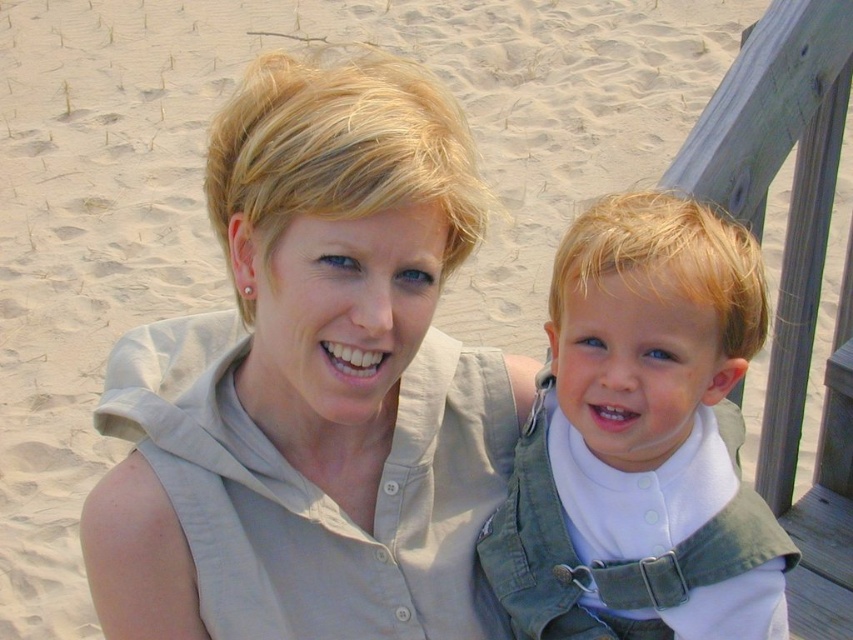
Question: Which point is farther to the camera?

Choices:
 (A) (366, 76)
 (B) (715, 572)

Answer: (B)

Question: Does matte beige shirt at upper center have a greater width compared to light green denim overalls at center?

Choices:
 (A) no
 (B) yes

Answer: (B)

Question: Does matte beige shirt at upper center have a greater width compared to light green denim overalls at center?

Choices:
 (A) yes
 (B) no

Answer: (A)

Question: Can you confirm if matte beige shirt at upper center is thinner than light green denim overalls at center?

Choices:
 (A) no
 (B) yes

Answer: (A)

Question: Which object appears farthest from the camera in this image?

Choices:
 (A) light green denim overalls at center
 (B) matte beige shirt at upper center

Answer: (A)